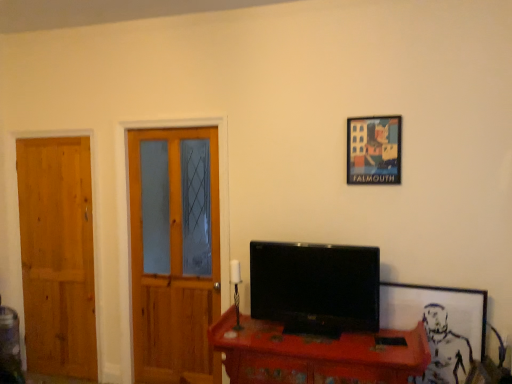
Question: Is wooden door at left, placed as the first door when sorted from right to left, next to white matte picture frame at right, placed as the second picture frame when sorted from left to right?

Choices:
 (A) no
 (B) yes

Answer: (A)

Question: Considering the relative sizes of wooden door at left, the 2th door in the left-to-right sequence, and white matte picture frame at right, the second picture frame positioned from the top, in the image provided, is wooden door at left, the 2th door in the left-to-right sequence, thinner than white matte picture frame at right, the second picture frame positioned from the top,?

Choices:
 (A) no
 (B) yes

Answer: (A)

Question: Is wooden door at left, placed as the first door when sorted from right to left, looking in the opposite direction of white matte picture frame at right, the second picture frame positioned from the top?

Choices:
 (A) yes
 (B) no

Answer: (B)

Question: From the image's perspective, does wooden door at left, the 2th door in the left-to-right sequence, appear lower than white matte picture frame at right, positioned as the 1th picture frame in right-to-left order?

Choices:
 (A) yes
 (B) no

Answer: (B)

Question: From the image's perspective, is wooden door at left, the 2th door in the left-to-right sequence, on white matte picture frame at right, positioned as the 1th picture frame in right-to-left order?

Choices:
 (A) no
 (B) yes

Answer: (B)

Question: Looking at their shapes, would you say black glossy tv at center is wider or thinner than natural wood door at left, the 2th door when ordered from right to left?

Choices:
 (A) thin
 (B) wide

Answer: (B)

Question: Would you say black glossy tv at center is inside or outside natural wood door at left, placed as the first door when sorted from left to right?

Choices:
 (A) outside
 (B) inside

Answer: (A)

Question: In terms of size, does black glossy tv at center appear bigger or smaller than natural wood door at left, the 2th door when ordered from right to left?

Choices:
 (A) small
 (B) big

Answer: (B)

Question: From the image's perspective, is black glossy tv at center above or below natural wood door at left, placed as the first door when sorted from left to right?

Choices:
 (A) below
 (B) above

Answer: (A)

Question: From the image's perspective, is wooden door at left, placed as the first door when sorted from right to left, above or below natural wood door at left, the 2th door when ordered from right to left?

Choices:
 (A) below
 (B) above

Answer: (B)

Question: Considering the positions of point (146, 188) and point (24, 228), is point (146, 188) closer or farther from the camera than point (24, 228)?

Choices:
 (A) farther
 (B) closer

Answer: (B)

Question: Considering the positions of wooden door at left, the 2th door in the left-to-right sequence, and natural wood door at left, the 2th door when ordered from right to left, in the image, is wooden door at left, the 2th door in the left-to-right sequence, bigger or smaller than natural wood door at left, the 2th door when ordered from right to left,?

Choices:
 (A) big
 (B) small

Answer: (A)

Question: Considering their positions, is wooden door at left, the 2th door in the left-to-right sequence, located in front of or behind natural wood door at left, placed as the first door when sorted from left to right?

Choices:
 (A) behind
 (B) front

Answer: (B)

Question: From the image's perspective, relative to white matte picture frame at right, which is counted as the first picture frame, starting from the bottom, is wooden desk at center above or below?

Choices:
 (A) above
 (B) below

Answer: (B)

Question: Considering the positions of wooden desk at center and white matte picture frame at right, which is counted as the first picture frame, starting from the bottom, in the image, is wooden desk at center taller or shorter than white matte picture frame at right, which is counted as the first picture frame, starting from the bottom,?

Choices:
 (A) tall
 (B) short

Answer: (B)